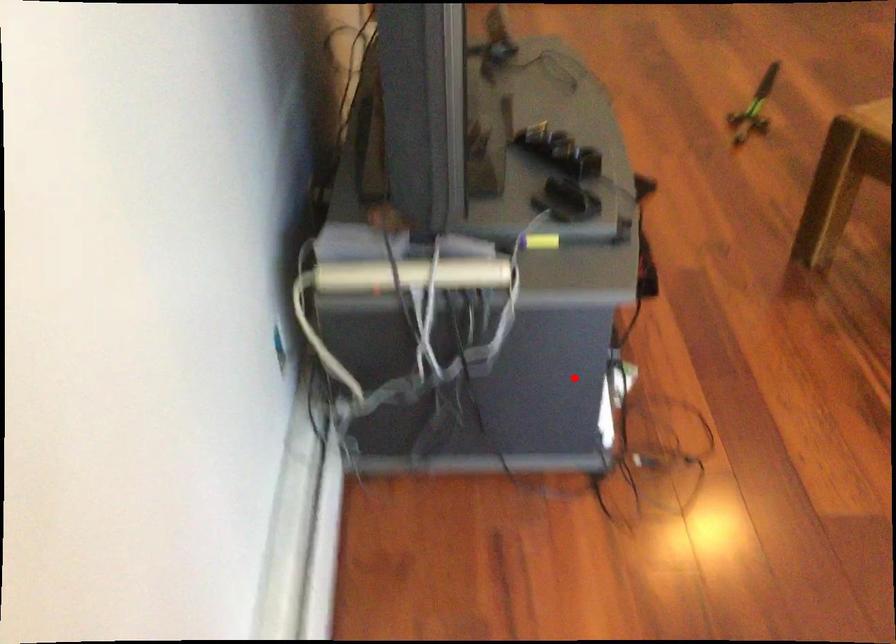
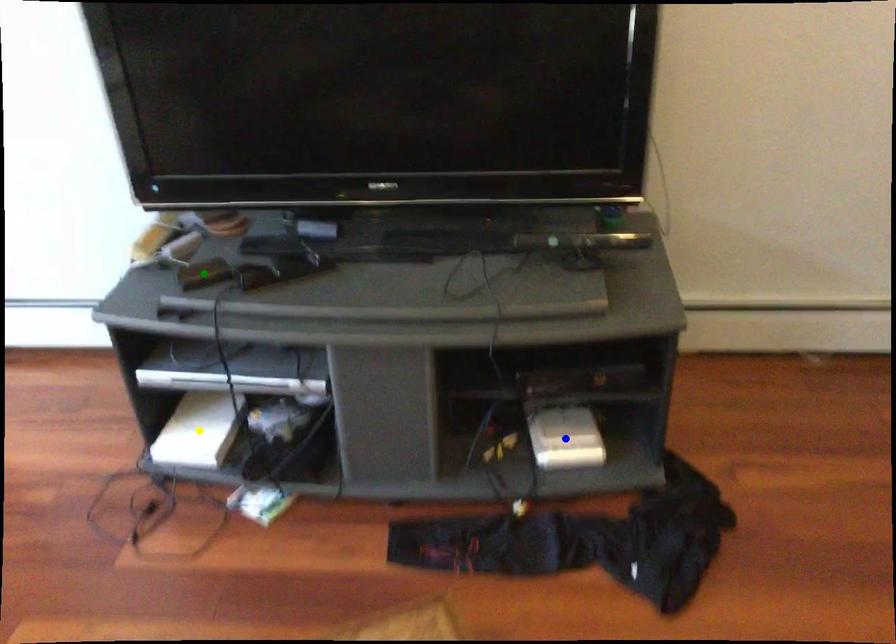
Question: I am providing you with two images of the same scene from different viewpoints. A red point is marked on the first image. You are given multiple points on the second image. Which mark in image 2 goes with the point in image 1?

Choices:
 (A) yellow point
 (B) green point
 (C) blue point

Answer: (A)